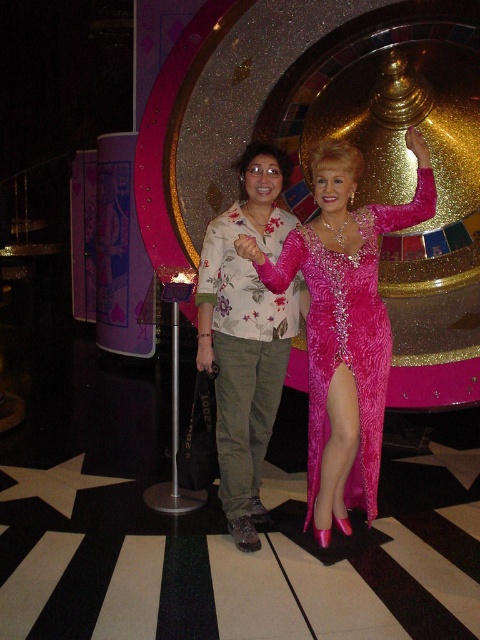
Question: Is floral print shirt at center to the right of shiny pink fabric dress at center from the viewer's perspective?

Choices:
 (A) yes
 (B) no

Answer: (B)

Question: Which object appears closest to the camera in this image?

Choices:
 (A) floral print shirt at center
 (B) shiny pink fabric dress at center

Answer: (B)

Question: Which point is farther to the camera?

Choices:
 (A) (338, 472)
 (B) (282, 237)

Answer: (B)

Question: Considering the relative positions of floral print shirt at center and shiny pink fabric dress at center in the image provided, where is floral print shirt at center located with respect to shiny pink fabric dress at center?

Choices:
 (A) right
 (B) left

Answer: (B)

Question: Is floral print shirt at center to the left of shiny pink fabric dress at center from the viewer's perspective?

Choices:
 (A) no
 (B) yes

Answer: (B)